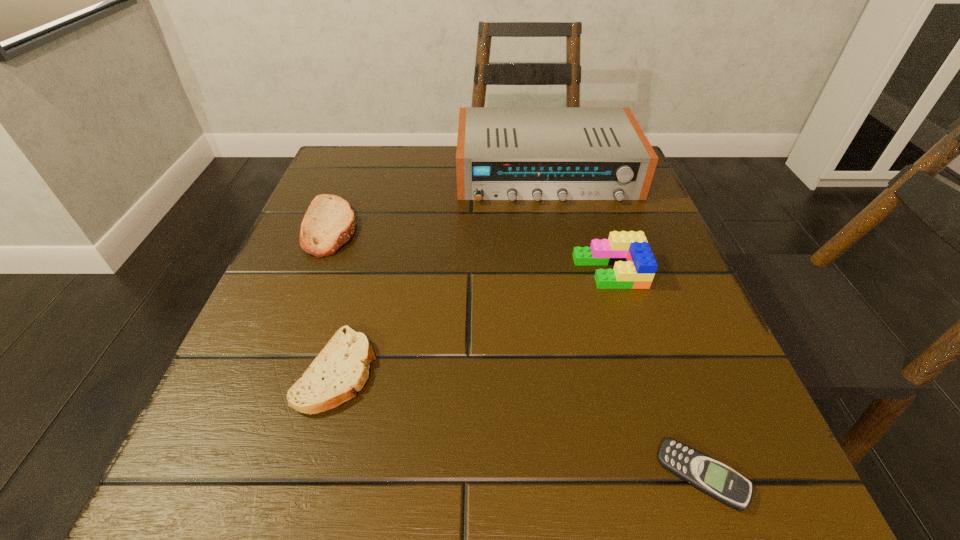
This screenshot has height=540, width=960. Identify the location of object that is at the far right corner. [x=503, y=153].

Identify the location of object that is at the near right corner. (708, 475).

Locate an element on the screen. The image size is (960, 540). vacant space at the far edge is located at coordinates (446, 161).

Where is `free region at the near edge of the desktop`? This screenshot has height=540, width=960. free region at the near edge of the desktop is located at coordinates (446, 471).

In the image, there is a desktop. At what (x,y) coordinates should I click in order to perform the action: click on vacant region at the left edge. Please return your answer as a coordinate pair (x, y). Image resolution: width=960 pixels, height=540 pixels. Looking at the image, I should click on (358, 293).

Find the location of a particular element. free region at the right edge is located at coordinates (697, 326).

Image resolution: width=960 pixels, height=540 pixels. Identify the location of vacant space at the far left corner. (352, 145).

The height and width of the screenshot is (540, 960). I want to click on vacant space in between the Lego and the third tallest object, so click(x=470, y=249).

The image size is (960, 540). I want to click on free point between the fourth tallest object and the taller pita bread, so click(x=334, y=299).

I want to click on free space between the fourth shortest object and the shorter pita bread, so click(x=473, y=321).